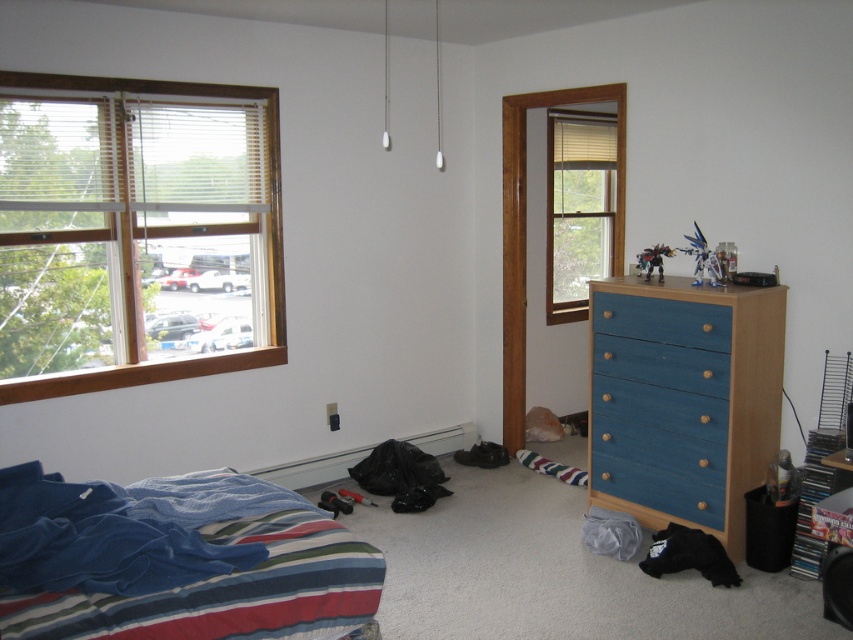
You are organizing the bedroom and need to place a new lamp between the blue cotton bedspread at lower left and the blue painted wood drawer at center right. Based on their positions, which object should the lamp be closer to?

The lamp should be placed closer to the blue cotton bedspread at lower left since it is positioned to the left of the blue painted wood drawer at center right, so the midpoint between them would be closer to the bedspread.

You are a housekeeper organizing the bedroom. You need to place a 1.5 meter tall plant stand in the room. Which object, the blue cotton bedspread at lower left or the blue painted wood drawer at center right, would you consider placing the plant stand next to based on their height?

The blue cotton bedspread at lower left is much taller than the blue painted wood drawer at center right, so placing the plant stand next to the blue cotton bedspread at lower left would be more stable due to its greater height.